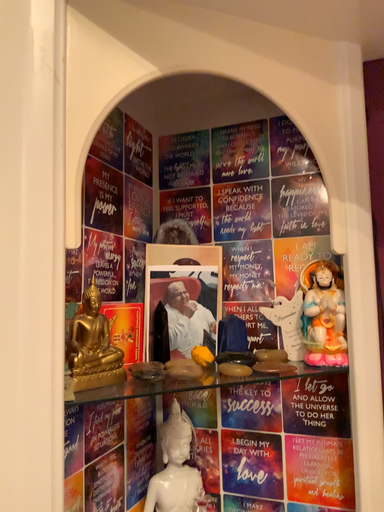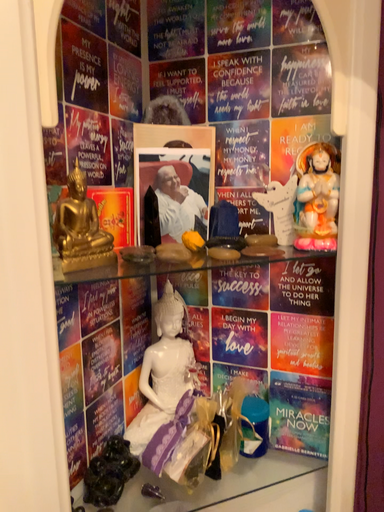
Question: How did the camera likely rotate when shooting the video?

Choices:
 (A) rotated downward
 (B) rotated upward

Answer: (A)